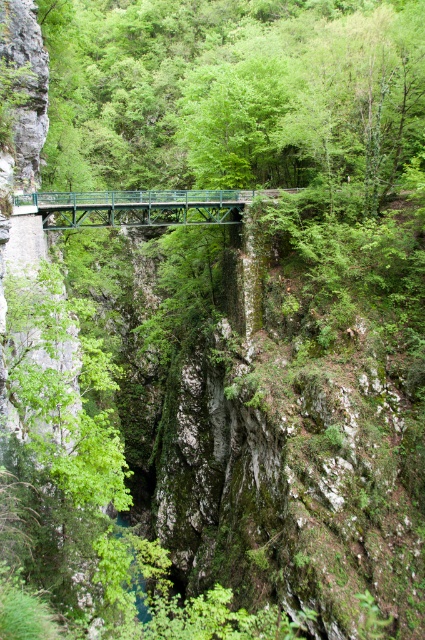
Is green leafy tree at center bigger than green metallic bridge at center?

Indeed, green leafy tree at center has a larger size compared to green metallic bridge at center.

Is point (135, 6) behind point (130, 211)?

Yes, it is.

Where is `green leafy tree at center`? green leafy tree at center is located at coordinates (232, 92).

This screenshot has height=640, width=425. Identify the location of green leafy tree at center. (232, 92).